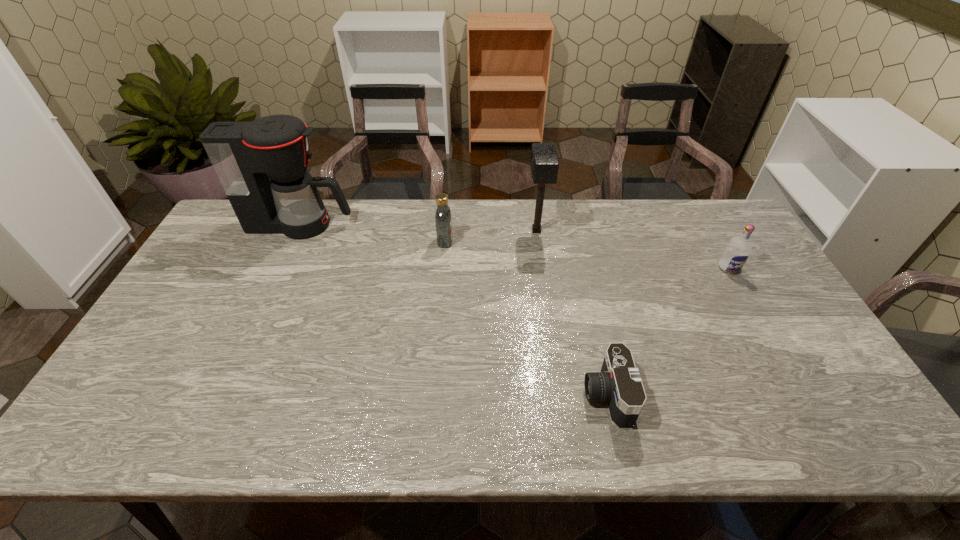
I want to click on free space that is in between the fourth object from left to right and the left vodka, so (x=526, y=318).

At what (x,y) coordinates should I click in order to perform the action: click on free space between the mallet and the shortest object. Please return your answer as a coordinate pair (x, y). This screenshot has height=540, width=960. Looking at the image, I should click on pos(571,313).

Identify the location of free spot between the fourth shortest object and the nearer vodka. This screenshot has height=540, width=960. (633, 249).

In order to click on empty location between the fourth object from right to left and the right vodka in this screenshot , I will do coord(587,254).

Identify the location of empty location between the shortest object and the farther vodka. This screenshot has width=960, height=540. (526, 318).

At what (x,y) coordinates should I click in order to perform the action: click on vacant space that's between the mallet and the left vodka. Please return your answer as a coordinate pair (x, y). The image size is (960, 540). Looking at the image, I should click on (491, 236).

The height and width of the screenshot is (540, 960). I want to click on free space between the tallest object and the left vodka, so click(372, 233).

The image size is (960, 540). I want to click on vacant region between the mallet and the rightmost object, so click(633, 249).

Locate an element on the screen. The image size is (960, 540). free space between the mallet and the right vodka is located at coordinates (633, 249).

Locate an element on the screen. vacant point located between the farther vodka and the third object from left to right is located at coordinates (491, 236).